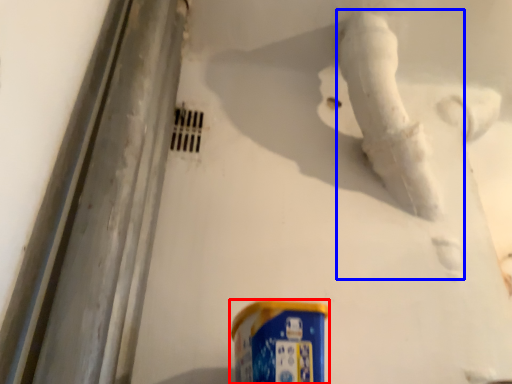
Question: Which point is closer to the camera, spray can (highlighted by a red box) or water pipe (highlighted by a blue box)?

Choices:
 (A) spray can
 (B) water pipe

Answer: (A)